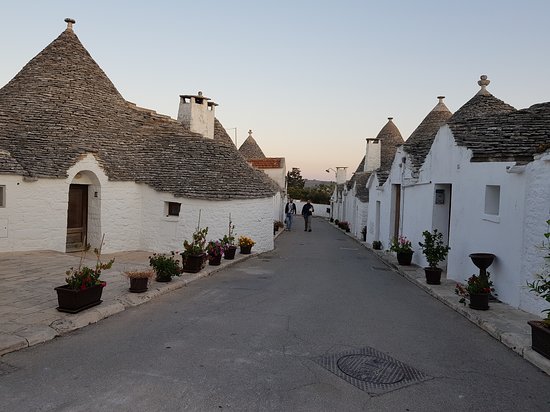
You are a GUI agent. You are given a task and a screenshot of the screen. Output one action in this format:
    pyautogui.click(x=<x>, y=<y>)
    Task: Click on the chimney
    The image size is (550, 412).
    Given the screenshot: What is the action you would take?
    pyautogui.click(x=376, y=155), pyautogui.click(x=338, y=175), pyautogui.click(x=212, y=126), pyautogui.click(x=198, y=122)